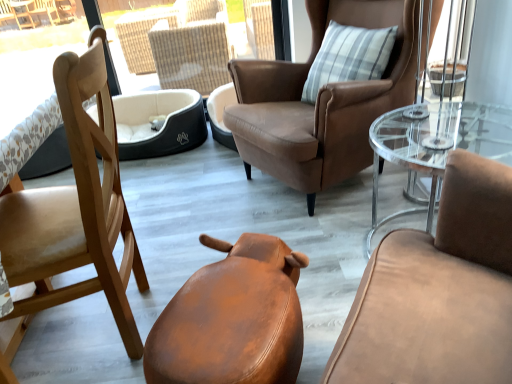
In order to face leather-like brown stool at lower center, which appears as the 2th chair when viewed from the left, should I rotate leftwards or rightwards?

Rotate your view left by about 1.849°.

Locate an element on the screen. The height and width of the screenshot is (384, 512). clear glass coffee table at right is located at coordinates 436,144.

Measure the distance between point (383, 143) and camera.

Point (383, 143) is 5.13 feet away from camera.

At what (x,y) coordinates should I click in order to perform the action: click on light brown wood chair at left, which is counted as the 3th chair, starting from the right. Please return your answer as a coordinate pair (x, y). Looking at the image, I should click on (74, 212).

Describe the element at coordinates (74, 212) in the screenshot. I see `light brown wood chair at left, which is counted as the 3th chair, starting from the right` at that location.

The width and height of the screenshot is (512, 384). Describe the element at coordinates (320, 102) in the screenshot. I see `brown leather chair at upper center, acting as the first chair starting from the right` at that location.

This screenshot has width=512, height=384. I want to click on leather-like brown stool at lower center, which appears as the 2th chair when viewed from the left, so click(232, 319).

Does point (122, 208) appear closer or farther from the camera than point (416, 69)?

Point (122, 208) is positioned closer to the camera compared to point (416, 69).

This screenshot has height=384, width=512. I want to click on the 1st chair below the light brown wood chair at left, which is counted as the 3th chair, starting from the right (from a real-world perspective), so click(x=320, y=102).

In the scene shown: Is light brown wood chair at left, which appears as the 1th chair when viewed from the left, turned away from brown leather chair at upper center, acting as the first chair starting from the right?

No, brown leather chair at upper center, acting as the first chair starting from the right, is not at the back of light brown wood chair at left, which appears as the 1th chair when viewed from the left.

Is light brown wood chair at left, which appears as the 1th chair when viewed from the left, facing away from clear glass coffee table at right?

Absolutely, light brown wood chair at left, which appears as the 1th chair when viewed from the left, is directed away from clear glass coffee table at right.

In the scene shown: Is light brown wood chair at left, which appears as the 1th chair when viewed from the left, beside clear glass coffee table at right?

No.

Starting from the clear glass coffee table at right, which chair is the 3rd one to the left? Please provide its 2D coordinates.

[(74, 212)]

Does light brown wood chair at left, which is counted as the 3th chair, starting from the right, appear on the left side of clear glass coffee table at right?

Indeed, light brown wood chair at left, which is counted as the 3th chair, starting from the right, is positioned on the left side of clear glass coffee table at right.

Which is in front, point (230, 325) or point (128, 159)?

Point (230, 325)

Identify the location of the 1st chair above the black fabric dog bed at center (from a real-world perspective). (232, 319).

Can you confirm if leather-like brown stool at lower center, the second chair from the right, is wider than black fabric dog bed at center?

In fact, leather-like brown stool at lower center, the second chair from the right, might be narrower than black fabric dog bed at center.

Measure the distance from leather-like brown stool at lower center, the second chair from the right, to black fabric dog bed at center.

leather-like brown stool at lower center, the second chair from the right, is 6.08 feet from black fabric dog bed at center.

Is brown leather chair at upper center, which ranks as the 3th chair in left-to-right order, oriented towards black fabric dog bed at center?

No.

Is brown leather chair at upper center, which ranks as the 3th chair in left-to-right order, smaller than black fabric dog bed at center?

No, brown leather chair at upper center, which ranks as the 3th chair in left-to-right order, is not smaller than black fabric dog bed at center.

Where is `dog bed located underneath the brown leather chair at upper center, which ranks as the 3th chair in left-to-right order (from a real-world perspective)`? Image resolution: width=512 pixels, height=384 pixels. dog bed located underneath the brown leather chair at upper center, which ranks as the 3th chair in left-to-right order (from a real-world perspective) is located at coordinates (163, 126).

Is brown leather chair at upper center, which ranks as the 3th chair in left-to-right order, placed right next to black fabric dog bed at center?

No, brown leather chair at upper center, which ranks as the 3th chair in left-to-right order, is not next to black fabric dog bed at center.

Does clear glass coffee table at right touch light brown wood chair at left, which appears as the 1th chair when viewed from the left?

clear glass coffee table at right is not next to light brown wood chair at left, which appears as the 1th chair when viewed from the left, and they're not touching.

Considering the positions of point (400, 153) and point (71, 157), is point (400, 153) closer or farther from the camera than point (71, 157)?

Point (400, 153).

Considering the relative sizes of clear glass coffee table at right and light brown wood chair at left, which appears as the 1th chair when viewed from the left, in the image provided, is clear glass coffee table at right wider than light brown wood chair at left, which appears as the 1th chair when viewed from the left,?

Result: Yes, clear glass coffee table at right is wider than light brown wood chair at left, which appears as the 1th chair when viewed from the left.

From the image's perspective, which one is positioned higher, clear glass coffee table at right or light brown wood chair at left, which appears as the 1th chair when viewed from the left?

clear glass coffee table at right, from the image's perspective.

Can black fabric dog bed at center be found inside light brown wood chair at left, which appears as the 1th chair when viewed from the left?

No, black fabric dog bed at center is not inside light brown wood chair at left, which appears as the 1th chair when viewed from the left.

Are light brown wood chair at left, which is counted as the 3th chair, starting from the right, and black fabric dog bed at center beside each other?

light brown wood chair at left, which is counted as the 3th chair, starting from the right, and black fabric dog bed at center are not in contact.

Which is in front, light brown wood chair at left, which appears as the 1th chair when viewed from the left, or black fabric dog bed at center?

light brown wood chair at left, which appears as the 1th chair when viewed from the left, is more forward.

From the image's perspective, is light brown wood chair at left, which is counted as the 3th chair, starting from the right, on top of black fabric dog bed at center?

No, from the image's perspective, light brown wood chair at left, which is counted as the 3th chair, starting from the right, is not over black fabric dog bed at center.

Could you measure the distance between brown leather chair at upper center, which ranks as the 3th chair in left-to-right order, and leather-like brown stool at lower center, which appears as the 2th chair when viewed from the left?

The distance of brown leather chair at upper center, which ranks as the 3th chair in left-to-right order, from leather-like brown stool at lower center, which appears as the 2th chair when viewed from the left, is 37.02 inches.

Is brown leather chair at upper center, which ranks as the 3th chair in left-to-right order, oriented towards leather-like brown stool at lower center, which appears as the 2th chair when viewed from the left?

No, brown leather chair at upper center, which ranks as the 3th chair in left-to-right order, is not facing towards leather-like brown stool at lower center, which appears as the 2th chair when viewed from the left.

From a real-world perspective, which object stands above the other?

brown leather chair at upper center, acting as the first chair starting from the right, is physically above.

From the image's perspective, does brown leather chair at upper center, which ranks as the 3th chair in left-to-right order, appear lower than leather-like brown stool at lower center, which appears as the 2th chair when viewed from the left?

No, from the image's perspective, brown leather chair at upper center, which ranks as the 3th chair in left-to-right order, is not below leather-like brown stool at lower center, which appears as the 2th chair when viewed from the left.

There is a brown leather chair at upper center, which ranks as the 3th chair in left-to-right order. Where is `the 1st chair below it (from the image's perspective)`? This screenshot has width=512, height=384. the 1st chair below it (from the image's perspective) is located at coordinates (74, 212).

This screenshot has height=384, width=512. Find the location of `chair that is the 2nd object above the clear glass coffee table at right (from a real-world perspective)`. chair that is the 2nd object above the clear glass coffee table at right (from a real-world perspective) is located at coordinates (74, 212).

Looking at the image, which one is located further to black fabric dog bed at center, clear glass coffee table at right or leather-like brown stool at lower center, which appears as the 2th chair when viewed from the left?

Among the two, leather-like brown stool at lower center, which appears as the 2th chair when viewed from the left, is located further to black fabric dog bed at center.

Looking at this image, which object lies further to the anchor point leather-like brown stool at lower center, which appears as the 2th chair when viewed from the left, brown leather chair at upper center, which ranks as the 3th chair in left-to-right order, or clear glass coffee table at right?

brown leather chair at upper center, which ranks as the 3th chair in left-to-right order, is further to leather-like brown stool at lower center, which appears as the 2th chair when viewed from the left.

Estimate the real-world distances between objects in this image. Which object is closer to light brown wood chair at left, which is counted as the 3th chair, starting from the right, brown leather chair at upper center, which ranks as the 3th chair in left-to-right order, or black fabric dog bed at center?

Based on the image, brown leather chair at upper center, which ranks as the 3th chair in left-to-right order, appears to be nearer to light brown wood chair at left, which is counted as the 3th chair, starting from the right.

Looking at the image, which one is located further to light brown wood chair at left, which is counted as the 3th chair, starting from the right, black fabric dog bed at center or leather-like brown stool at lower center, which appears as the 2th chair when viewed from the left?

black fabric dog bed at center lies further to light brown wood chair at left, which is counted as the 3th chair, starting from the right, than the other object.

When comparing their distances from black fabric dog bed at center, does leather-like brown stool at lower center, the second chair from the right, or clear glass coffee table at right seem closer?

Among the two, clear glass coffee table at right is located nearer to black fabric dog bed at center.

Estimate the real-world distances between objects in this image. Which object is closer to light brown wood chair at left, which is counted as the 3th chair, starting from the right, leather-like brown stool at lower center, the second chair from the right, or brown leather chair at upper center, acting as the first chair starting from the right?

leather-like brown stool at lower center, the second chair from the right, is positioned closer to the anchor light brown wood chair at left, which is counted as the 3th chair, starting from the right.

Based on the photo, based on their spatial positions, is light brown wood chair at left, which appears as the 1th chair when viewed from the left, or brown leather chair at upper center, which ranks as the 3th chair in left-to-right order, closer to clear glass coffee table at right?

brown leather chair at upper center, which ranks as the 3th chair in left-to-right order, is closer to clear glass coffee table at right.

When comparing their distances from brown leather chair at upper center, which ranks as the 3th chair in left-to-right order, does light brown wood chair at left, which appears as the 1th chair when viewed from the left, or leather-like brown stool at lower center, the second chair from the right, seem closer?

leather-like brown stool at lower center, the second chair from the right, is positioned closer to the anchor brown leather chair at upper center, which ranks as the 3th chair in left-to-right order.

This screenshot has height=384, width=512. Find the location of `coffee table that lies between brown leather chair at upper center, which ranks as the 3th chair in left-to-right order, and leather-like brown stool at lower center, the second chair from the right, from top to bottom`. coffee table that lies between brown leather chair at upper center, which ranks as the 3th chair in left-to-right order, and leather-like brown stool at lower center, the second chair from the right, from top to bottom is located at coordinates (436, 144).

The width and height of the screenshot is (512, 384). Find the location of `chair between light brown wood chair at left, which is counted as the 3th chair, starting from the right, and black fabric dog bed at center, along the z-axis`. chair between light brown wood chair at left, which is counted as the 3th chair, starting from the right, and black fabric dog bed at center, along the z-axis is located at coordinates (320, 102).

You are a GUI agent. You are given a task and a screenshot of the screen. Output one action in this format:
    pyautogui.click(x=<x>, y=<y>)
    Task: Click on the coffee table between leather-like brown stool at lower center, which appears as the 2th chair when viewed from the left, and black fabric dog bed at center in the front-back direction
    This screenshot has height=384, width=512.
    Given the screenshot: What is the action you would take?
    pyautogui.click(x=436, y=144)

Identify the location of chair situated between light brown wood chair at left, which is counted as the 3th chair, starting from the right, and brown leather chair at upper center, acting as the first chair starting from the right, from left to right. The height and width of the screenshot is (384, 512). (232, 319).